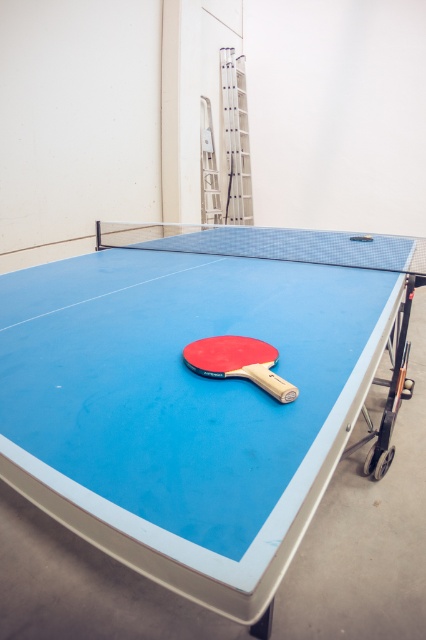
Does point (261, 307) lie in front of point (233, 364)?

No, (261, 307) is behind (233, 364).

Between point (75, 497) and point (236, 353), which one is positioned behind?

The point (236, 353) is more distant.

Where is `blue rubber table at center`? blue rubber table at center is located at coordinates (198, 394).

The height and width of the screenshot is (640, 426). I want to click on blue rubber table at center, so click(198, 394).